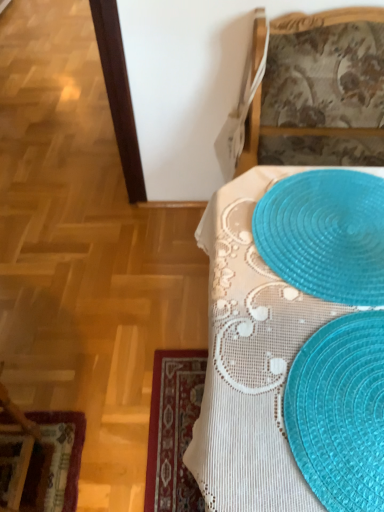
Find the location of a particular element. vacant area situated below translucent plastic placemat at upper right (from a real-world perspective) is located at coordinates (335, 233).